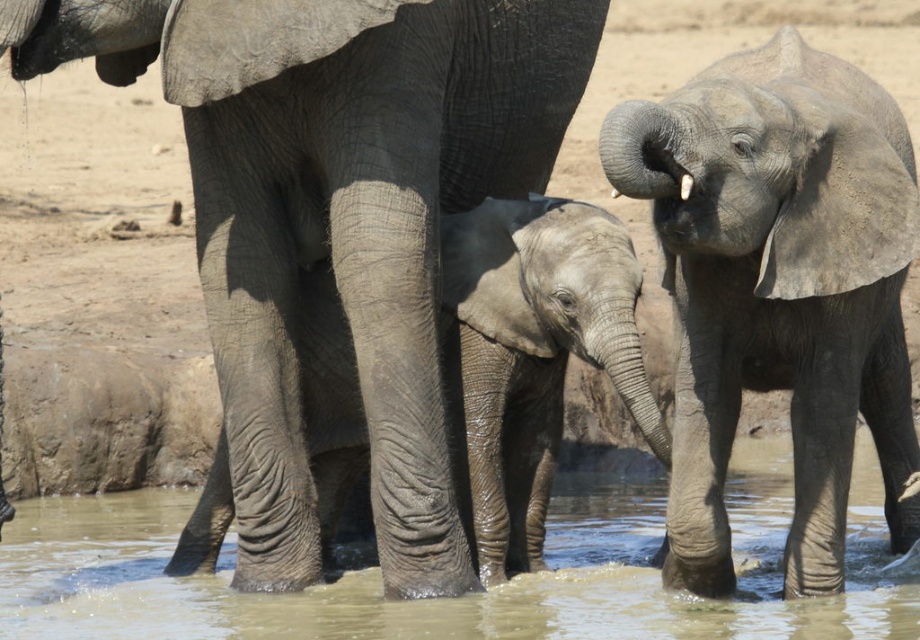
Question: Which point is farther to the camera?

Choices:
 (A) gray textured baby elephant at center
 (B) gray matte elephant at center

Answer: (A)

Question: Can you confirm if gray matte elephant at center is bigger than gray textured baby elephant at center?

Choices:
 (A) no
 (B) yes

Answer: (B)

Question: Which object is farther from the camera taking this photo?

Choices:
 (A) gray textured baby elephant at center
 (B) gray matte elephant at center
 (C) gray wrinkled elephant at center

Answer: (A)

Question: Which is farther from the brown muddy water at center?

Choices:
 (A) gray wrinkled elephant at center
 (B) gray matte elephant at center
 (C) gray textured baby elephant at center

Answer: (A)

Question: Does gray matte elephant at center have a larger size compared to brown muddy water at center?

Choices:
 (A) yes
 (B) no

Answer: (A)

Question: Can you confirm if gray matte elephant at center is positioned below brown muddy water at center?

Choices:
 (A) no
 (B) yes

Answer: (A)